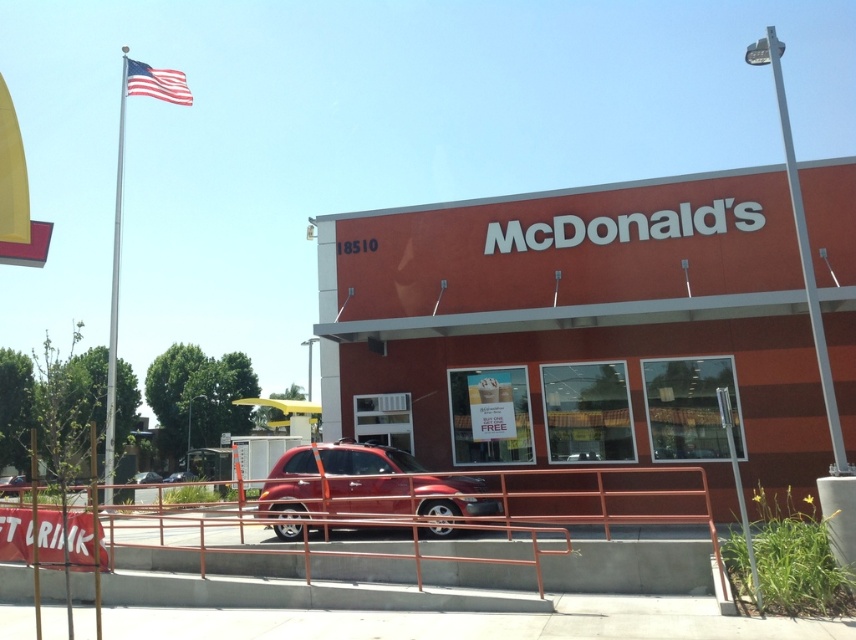
Does matte red car at lower center appear on the left side of metallic red suv at lower center?

Incorrect, matte red car at lower center is not on the left side of metallic red suv at lower center.

Can you confirm if matte red car at lower center is positioned above metallic red suv at lower center?

Yes, matte red car at lower center is above metallic red suv at lower center.

Is point (747, 186) positioned in front of point (158, 481)?

That is True.

Identify the location of matte red car at lower center. (578, 328).

Who is lower down, shiny red suv at center or silver metallic pole at upper right?

shiny red suv at center is below.

Can you confirm if shiny red suv at center is positioned below silver metallic pole at upper right?

Correct, shiny red suv at center is located below silver metallic pole at upper right.

Measure the distance between shiny red suv at center and camera.

They are 8.45 meters apart.

The image size is (856, 640). What are the coordinates of `shiny red suv at center` in the screenshot? It's located at (366, 492).

Can you confirm if shiny red suv at center is positioned below silver metallic flag pole at left?

Yes.

Between shiny red suv at center and silver metallic flag pole at left, which one is positioned higher?

silver metallic flag pole at left

At what (x,y) coordinates should I click in order to perform the action: click on shiny red suv at center. Please return your answer as a coordinate pair (x, y). This screenshot has width=856, height=640. Looking at the image, I should click on (366, 492).

The image size is (856, 640). I want to click on shiny red suv at center, so click(x=366, y=492).